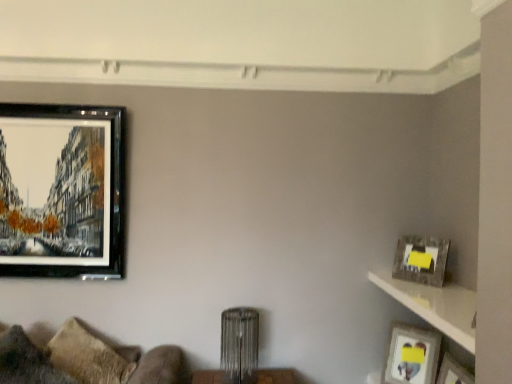
Question: Is matte gray picture frame at upper right, which ranks as the second picture frame in top-to-bottom order, bigger than matte black picture frame at upper left, the 1th picture frame viewed from the left?

Choices:
 (A) no
 (B) yes

Answer: (A)

Question: Is matte black picture frame at upper left, acting as the 3th picture frame starting from the right, a part of matte gray picture frame at upper right, the 3th picture frame in the left-to-right sequence?

Choices:
 (A) no
 (B) yes

Answer: (A)

Question: From a real-world perspective, is matte gray picture frame at upper right, which is the 1th picture frame in right-to-left order, located higher than matte black picture frame at upper left, which appears as the 1th picture frame when viewed from the top?

Choices:
 (A) no
 (B) yes

Answer: (A)

Question: Considering the relative positions of matte gray picture frame at upper right, placed as the 2th picture frame when sorted from bottom to top, and matte black picture frame at upper left, which appears as the 1th picture frame when viewed from the top, in the image provided, is matte gray picture frame at upper right, placed as the 2th picture frame when sorted from bottom to top, to the left of matte black picture frame at upper left, which appears as the 1th picture frame when viewed from the top, from the viewer's perspective?

Choices:
 (A) yes
 (B) no

Answer: (B)

Question: Is the position of matte gray picture frame at upper right, placed as the 2th picture frame when sorted from bottom to top, less distant than that of matte black picture frame at upper left, acting as the 3th picture frame starting from the right?

Choices:
 (A) yes
 (B) no

Answer: (A)

Question: From the image's perspective, is matte silver picture frame at right, marked as the 2th picture frame in a right-to-left arrangement, positioned above or below textured brown pillow at lower left?

Choices:
 (A) below
 (B) above

Answer: (A)

Question: From a real-world perspective, is matte silver picture frame at right, the 2th picture frame from the left, above or below textured brown pillow at lower left?

Choices:
 (A) above
 (B) below

Answer: (B)

Question: Visually, is matte silver picture frame at right, the 2th picture frame from the left, positioned to the left or to the right of textured brown pillow at lower left?

Choices:
 (A) left
 (B) right

Answer: (B)

Question: Is matte silver picture frame at right, marked as the 2th picture frame in a right-to-left arrangement, spatially inside textured brown pillow at lower left, or outside of it?

Choices:
 (A) inside
 (B) outside

Answer: (B)

Question: From a real-world perspective, is textured brown pillow at lower left above or below matte silver picture frame at right, marked as the 2th picture frame in a right-to-left arrangement?

Choices:
 (A) above
 (B) below

Answer: (A)

Question: Is textured brown pillow at lower left to the left or to the right of matte silver picture frame at right, marked as the 2th picture frame in a right-to-left arrangement, in the image?

Choices:
 (A) right
 (B) left

Answer: (B)

Question: Is textured brown pillow at lower left situated inside matte silver picture frame at right, the first picture frame when ordered from bottom to top, or outside?

Choices:
 (A) outside
 (B) inside

Answer: (A)

Question: In terms of height, does textured brown pillow at lower left look taller or shorter compared to matte silver picture frame at right, marked as the 2th picture frame in a right-to-left arrangement?

Choices:
 (A) short
 (B) tall

Answer: (B)

Question: From the image's perspective, is velvet beige couch at lower left positioned above or below matte silver picture frame at right, the 3th picture frame in the top-to-bottom sequence?

Choices:
 (A) below
 (B) above

Answer: (B)

Question: Relative to matte silver picture frame at right, marked as the 2th picture frame in a right-to-left arrangement, is velvet beige couch at lower left in front or behind?

Choices:
 (A) behind
 (B) front

Answer: (B)